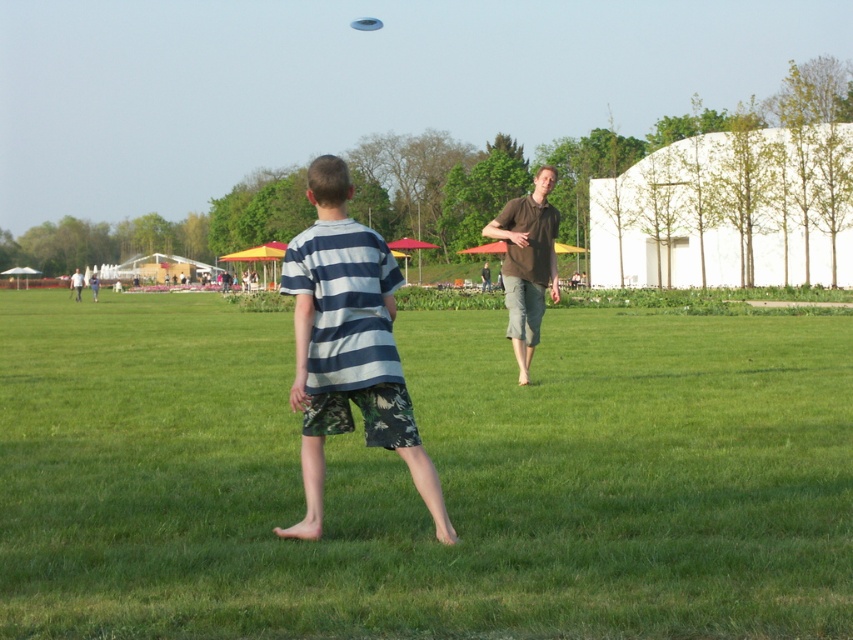
What do you see at coordinates (347, 346) in the screenshot? I see `striped cotton shirt at center` at bounding box center [347, 346].

Who is positioned more to the right, striped cotton shirt at center or blue plastic frisbee at upper center?

From the viewer's perspective, striped cotton shirt at center appears more on the right side.

Between point (340, 244) and point (380, 28), which one is positioned in front?

Point (340, 244) is more forward.

Find the location of a particular element. The height and width of the screenshot is (640, 853). striped cotton shirt at center is located at coordinates (347, 346).

Which is below, green grass at center or brown cotton shirt at center?

green grass at center is lower down.

Can you confirm if green grass at center is taller than brown cotton shirt at center?

In fact, green grass at center may be shorter than brown cotton shirt at center.

Who is more forward, (491, 424) or (537, 192)?

Point (491, 424) is more forward.

At what (x,y) coordinates should I click in order to perform the action: click on green grass at center. Please return your answer as a coordinate pair (x, y). The width and height of the screenshot is (853, 640). Looking at the image, I should click on (438, 474).

Consider the image. Between green grass at center and striped cotton shirt at center, which one appears on the right side from the viewer's perspective?

Positioned to the right is green grass at center.

Between green grass at center and striped cotton shirt at center, which one has less height?

green grass at center

Which is in front, point (846, 356) or point (309, 196)?

Point (309, 196)

Find the location of a particular element. Image resolution: width=853 pixels, height=640 pixels. green grass at center is located at coordinates (438, 474).